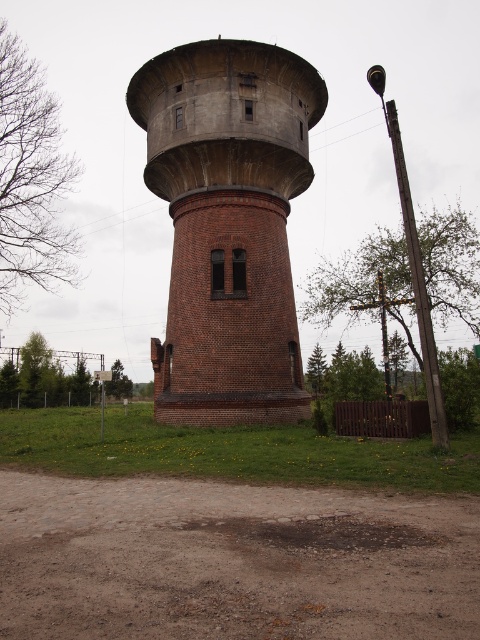
Locate an element on the screen. Image resolution: width=480 pixels, height=640 pixels. brown gravel dirt at center is located at coordinates (231, 561).

Identify the location of brown gravel dirt at center. (231, 561).

The width and height of the screenshot is (480, 640). Identify the location of brown gravel dirt at center. (231, 561).